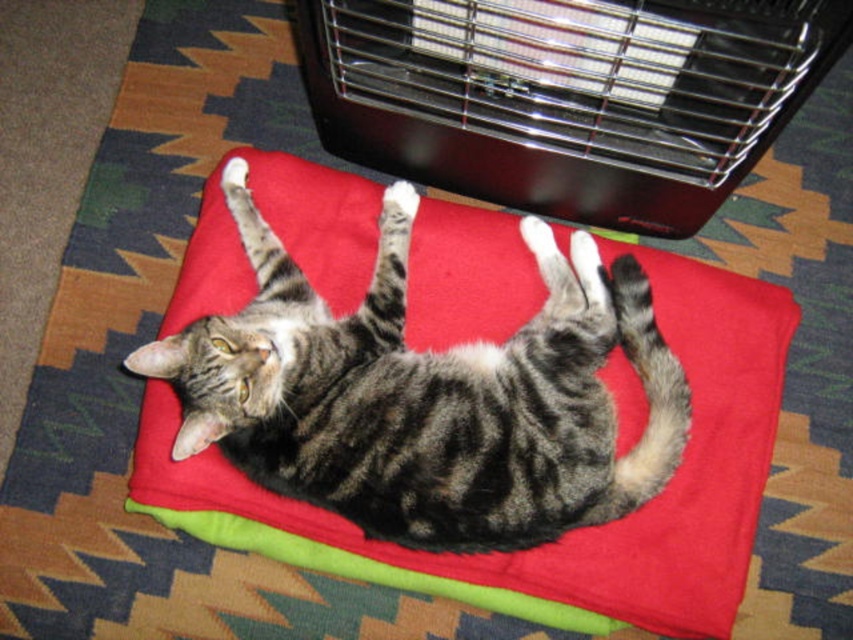
You are a photographer trying to capture a closeup of the tabby fur cat at center without including the black metal heater at upper center in the frame. Based on their sizes, is it possible to do so?

The tabby fur cat at center is smaller than the black metal heater at upper center, so it might be challenging to frame the cat closely without including the heater if they are positioned in a way that the heater is near the cat. However, since the cat is smaller, adjusting the camera angle or zoom could help focus solely on the cat, excluding the heater.

You are a photographer setting up a shoot with a tabby fur cat at center and a black metal heater at upper center. You want to ensure the cat is in the foreground and the heater is in the background. Does the current arrangement meet your requirement?

Yes, the current arrangement meets the requirement because the tabby fur cat at center is located below the black metal heater at upper center, placing the cat in the foreground and the heater in the background.

You are taking a photo of the tabby cat on the red blanket. You notice two points in the image labeled as point (398, 262) and point (730, 17). Which point is closer to the camera?

Point (398, 262) is closer to the camera than point (730, 17) because it is further to the camera than the other point.